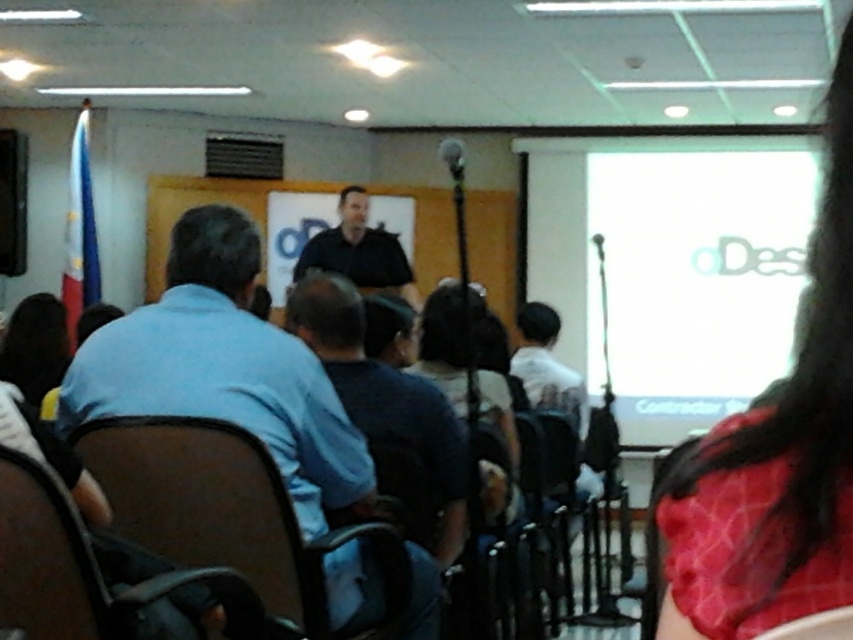
You are an event organizer who needs to arrange seating for a photo op. The photo will require the two speakers wearing the dark blue shirt at center and black matte shirt at center to stand side by side. Based on their shirt colors and the scene description, which speaker should stand to the left to ensure proper visibility for the photo?

The dark blue shirt at center should stand to the left because it is taller than the black matte shirt at center, ensuring better visibility in the photo.